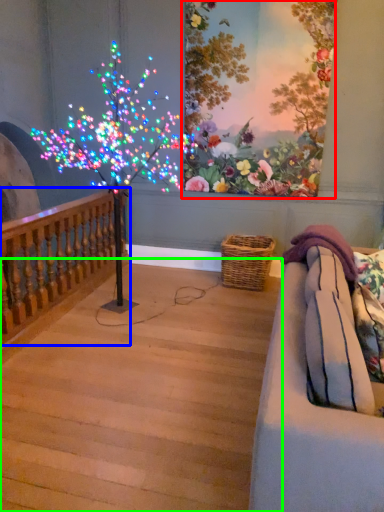
Question: Which is farther away from floral arrangement (highlighted by a red box)? rail (highlighted by a blue box) or stairwell (highlighted by a green box)?

Choices:
 (A) rail
 (B) stairwell

Answer: (B)